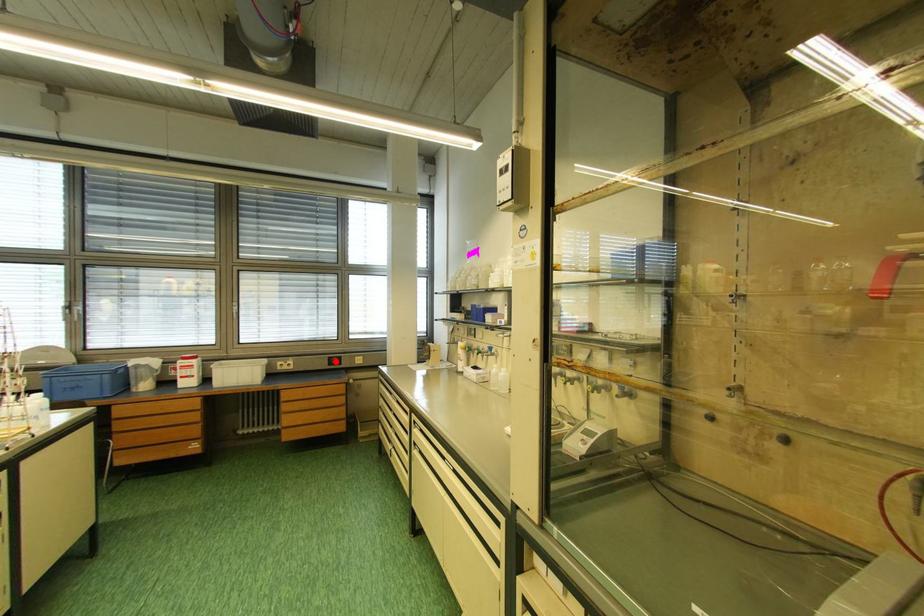
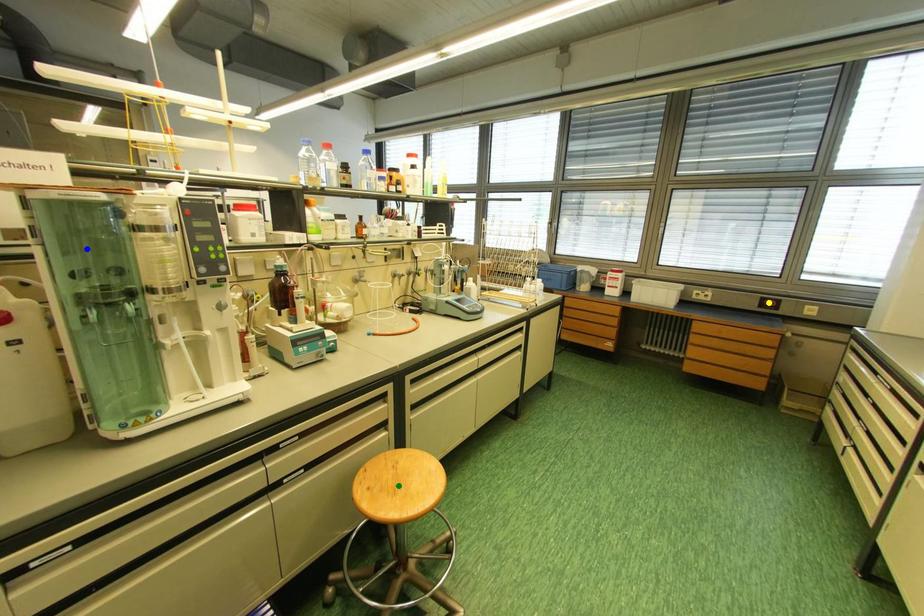
Question: I am providing you with two images of the same scene from different viewpoints. A red point is marked on the first image. You are given multiple points on the second image. Which point in image 2 is actually the same real-world point as the red point in image 1?

Choices:
 (A) green point
 (B) blue point
 (C) yellow point

Answer: (C)